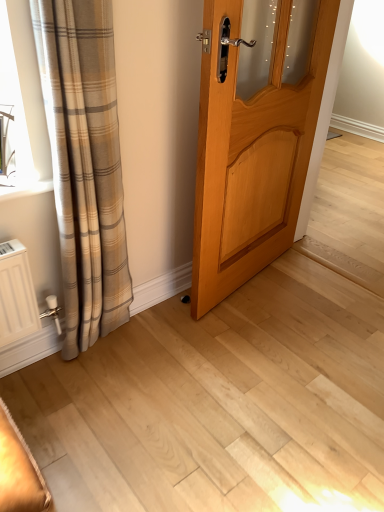
Identify the location of vacant area that lies to the right of plaid fabric curtain at left. (163, 351).